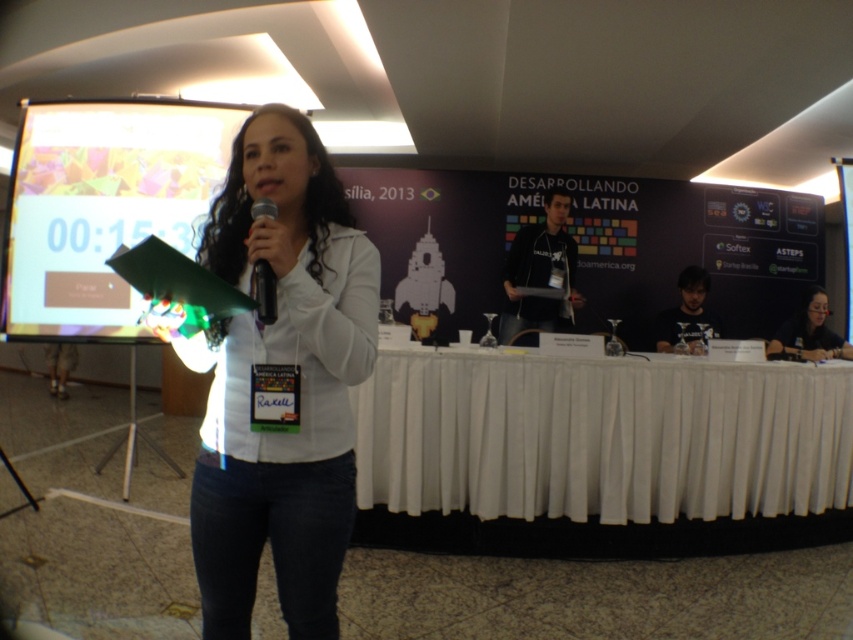
Question: From the image, what is the correct spatial relationship of white cloth at center in relation to white matte jacket at center?

Choices:
 (A) below
 (B) above

Answer: (A)

Question: Which is farther from the matte green book at upper left?

Choices:
 (A) matte black laptop at lower right
 (B) white cloth at center
 (C) black plastic microphone at center

Answer: (A)

Question: Can you confirm if white cloth at center is positioned to the left of matte black laptop at lower right?

Choices:
 (A) no
 (B) yes

Answer: (B)

Question: Which point appears closest to the camera in this image?

Choices:
 (A) (808, 356)
 (B) (260, 211)
 (C) (625, 474)
 (D) (312, 624)

Answer: (B)

Question: Which of the following is the farthest from the observer?

Choices:
 (A) white cloth at center
 (B) black plastic microphone at center
 (C) white matte jacket at center

Answer: (A)

Question: Is white matte jacket at center above black plastic microphone at center?

Choices:
 (A) yes
 (B) no

Answer: (B)